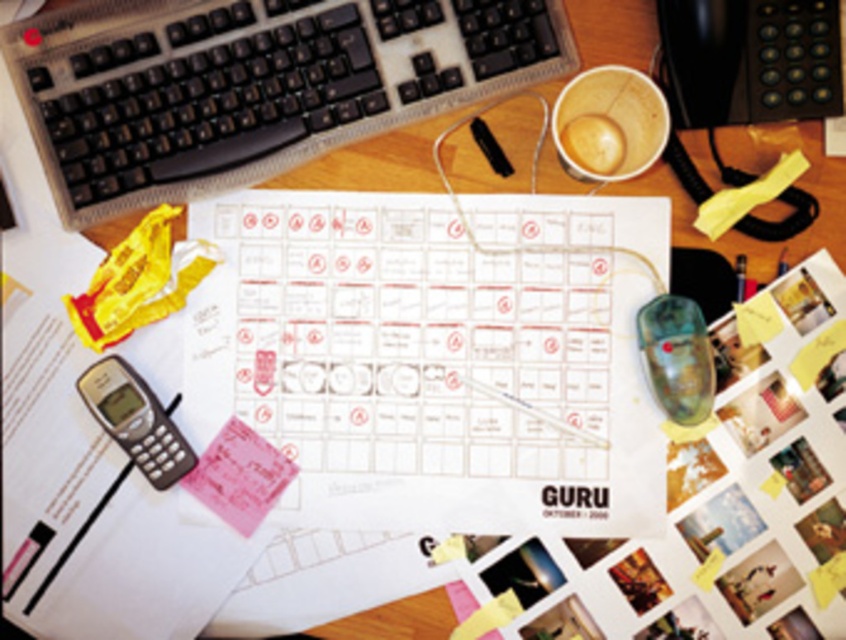
You are sitting at the desk and want to pick up the gray plastic phone at bottom left. Is it possible to reach it without moving the black plastic keyboard at upper left?

The gray plastic phone at bottom left is behind the black plastic keyboard at upper left, so you cannot reach it without moving the black plastic keyboard at upper left.

You are setting up a new monitor stand on your desk and need to place the black plastic keyboard at upper left and gray plastic phone at bottom left. Since the monitor stand will occupy the space between them, which object should be moved first to make room?

The black plastic keyboard at upper left should be moved first because it is much taller than the gray plastic phone at bottom left, so it might block the monitor stand placement more significantly.